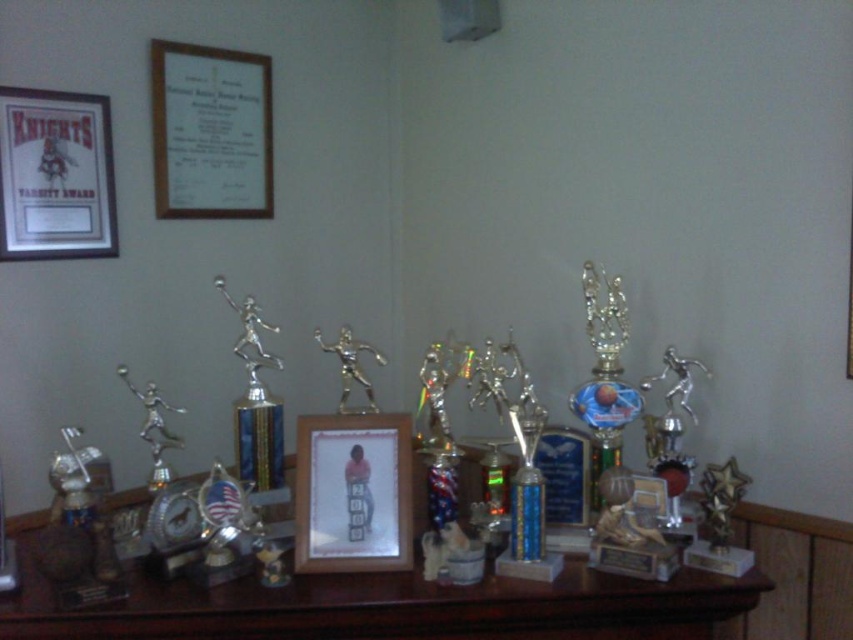
Question: Is wooden table at center below silver metallic figure at center?

Choices:
 (A) no
 (B) yes

Answer: (B)

Question: Is wooden table at center to the right of silver metallic figure at left from the viewer's perspective?

Choices:
 (A) no
 (B) yes

Answer: (B)

Question: Estimate the real-world distances between objects in this image. Which object is closer to the matte black frame at upper left?

Choices:
 (A) silver metallic figure at left
 (B) wooden photo frame at center

Answer: (A)

Question: Which point is closer to the camera taking this photo?

Choices:
 (A) (376, 493)
 (B) (178, 410)
 (C) (465, 611)
 (D) (602, 326)

Answer: (C)

Question: Which is nearer to the silver metallic figure at center?

Choices:
 (A) wooden table at center
 (B) wooden photo frame at center
 (C) gold shiny basketball trophy at center

Answer: (B)

Question: Can you confirm if gold shiny basketball trophy at center is positioned to the left of silver metallic figure at left?

Choices:
 (A) no
 (B) yes

Answer: (A)